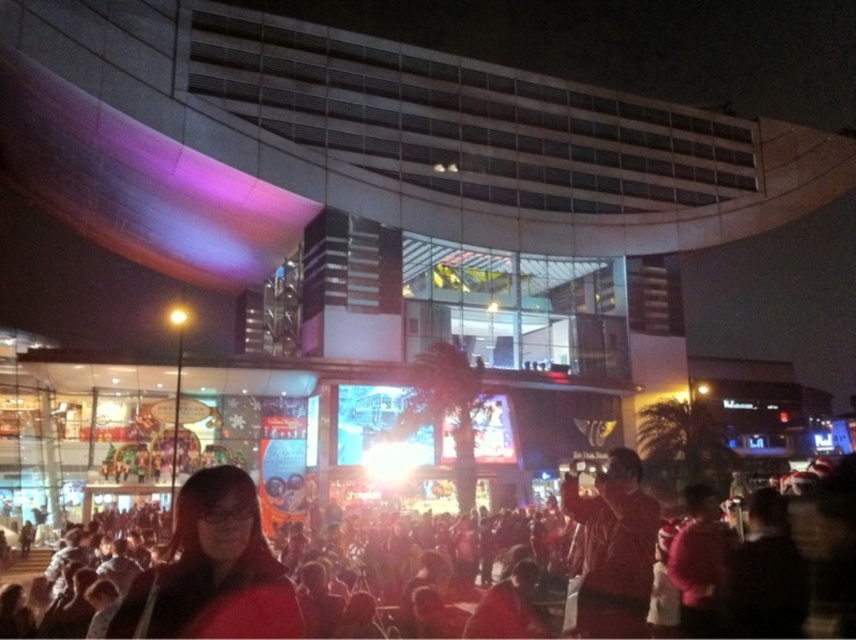
Question: Is matte black hair at lower center smaller than red leather jacket at lower right?

Choices:
 (A) yes
 (B) no

Answer: (A)

Question: Where is matte black crowd at center located in relation to matte black hair at lower center in the image?

Choices:
 (A) left
 (B) right

Answer: (B)

Question: Which point is farther to the camera?

Choices:
 (A) matte black hair at lower center
 (B) matte black crowd at center

Answer: (B)

Question: Which object is farther from the camera taking this photo?

Choices:
 (A) matte black crowd at center
 (B) red leather jacket at lower right

Answer: (B)

Question: Estimate the real-world distances between objects in this image. Which object is farther from the matte black crowd at center?

Choices:
 (A) red leather jacket at lower right
 (B) matte black hair at lower center

Answer: (B)

Question: In this image, where is matte black crowd at center located relative to matte black hair at lower center?

Choices:
 (A) below
 (B) above

Answer: (A)